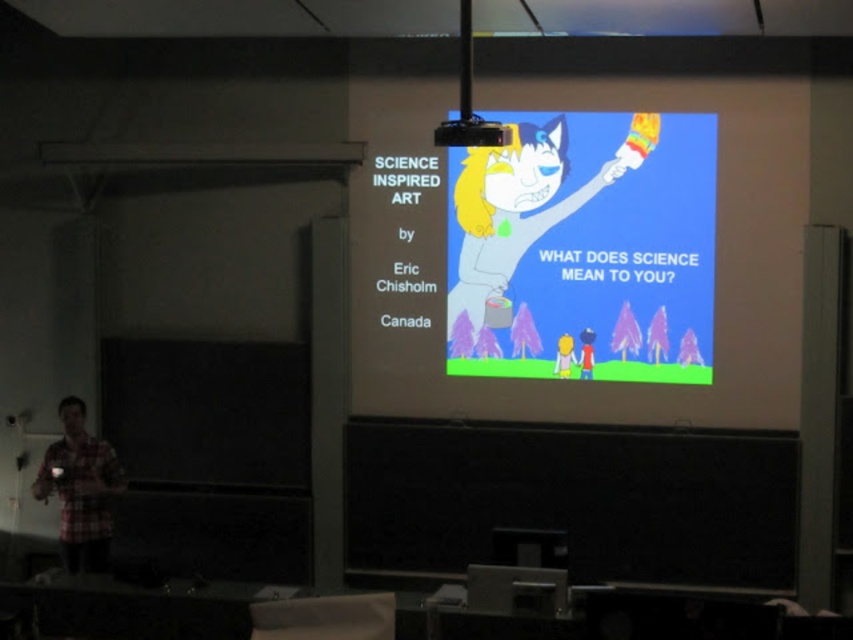
Question: Where is plaid flannel shirt at lower left located in relation to black plastic projector at upper center in the image?

Choices:
 (A) left
 (B) right

Answer: (A)

Question: Which point is farther from the camera taking this photo?

Choices:
 (A) (457, 132)
 (B) (114, 464)

Answer: (B)

Question: Which of the following is the farthest from the observer?

Choices:
 (A) (461, 10)
 (B) (51, 461)

Answer: (B)

Question: Can you confirm if cartoon character at upper right is bigger than black plastic projector at upper center?

Choices:
 (A) no
 (B) yes

Answer: (B)

Question: Which object is positioned closest to the plaid flannel shirt at lower left?

Choices:
 (A) black plastic projector at upper center
 (B) cartoon character at upper right

Answer: (B)

Question: Can you confirm if plaid flannel shirt at lower left is bigger than black plastic projector at upper center?

Choices:
 (A) no
 (B) yes

Answer: (B)